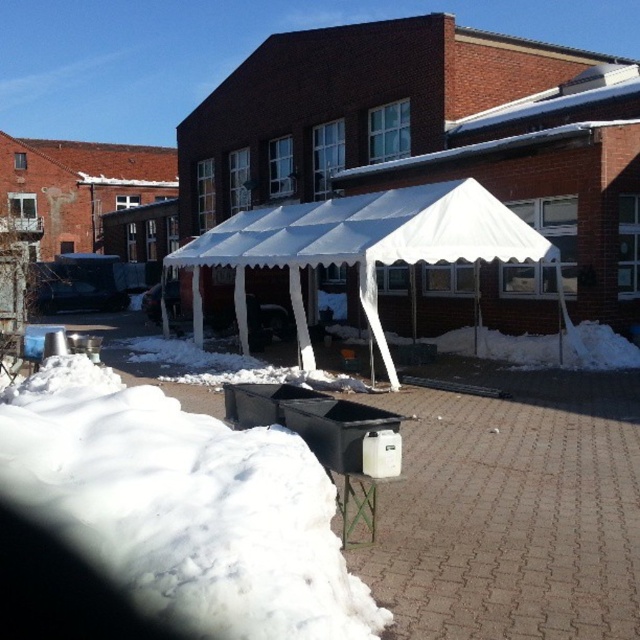
Is point (184, 582) positioned behind point (388, 243)?

No.

Image resolution: width=640 pixels, height=640 pixels. What do you see at coordinates (182, 506) in the screenshot? I see `white fluffy snow at lower left` at bounding box center [182, 506].

At what (x,y) coordinates should I click in order to perform the action: click on white fluffy snow at lower left. Please return your answer as a coordinate pair (x, y). The height and width of the screenshot is (640, 640). Looking at the image, I should click on point(182,506).